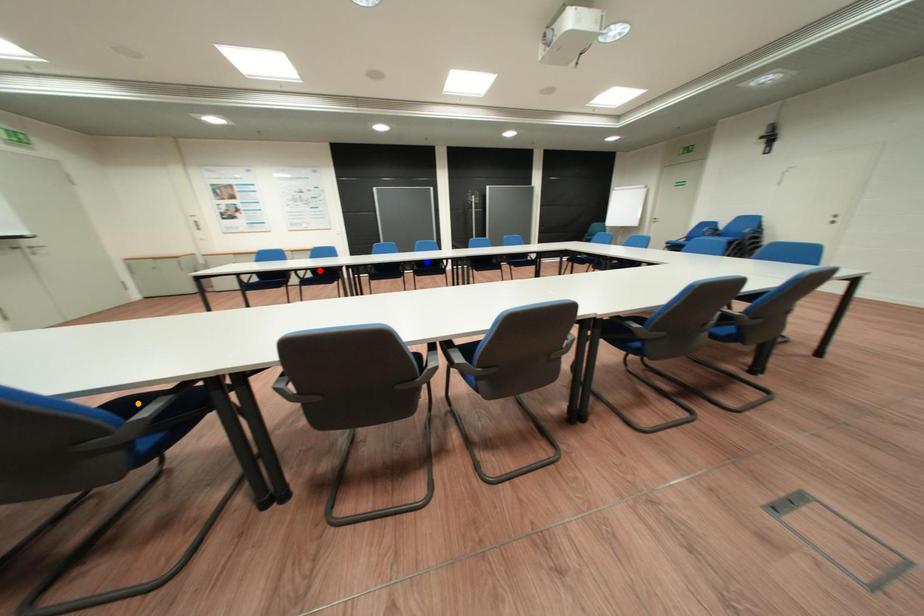
Order these from nearest to farthest:
red point, orange point, blue point

orange point, red point, blue point